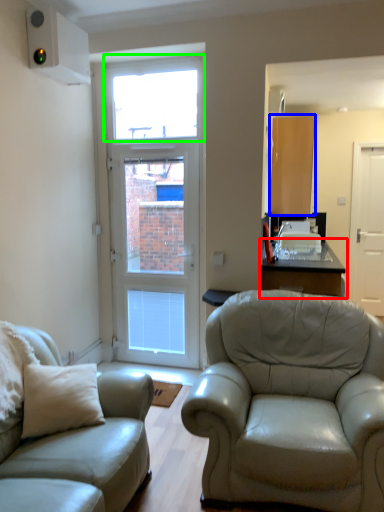
Question: Which is farther away from table (highlighted by a red box)? cabinetry (highlighted by a blue box) or window (highlighted by a green box)?

Choices:
 (A) cabinetry
 (B) window

Answer: (B)